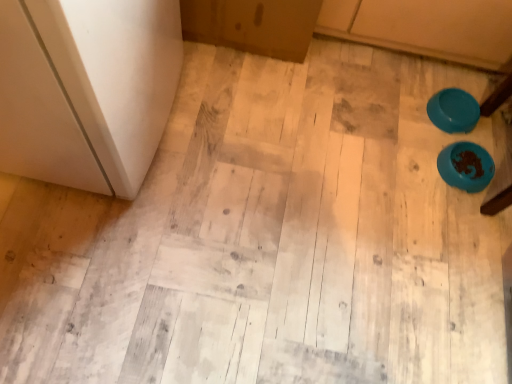
You are a GUI agent. You are given a task and a screenshot of the screen. Output one action in this format:
    pyautogui.click(x=<x>, y=<y>)
    Task: Click on the unoccupied area behind blue plastic bowl at lower right, the first bowl positioned from the bottom
    The height and width of the screenshot is (384, 512).
    Given the screenshot: What is the action you would take?
    pyautogui.click(x=472, y=126)